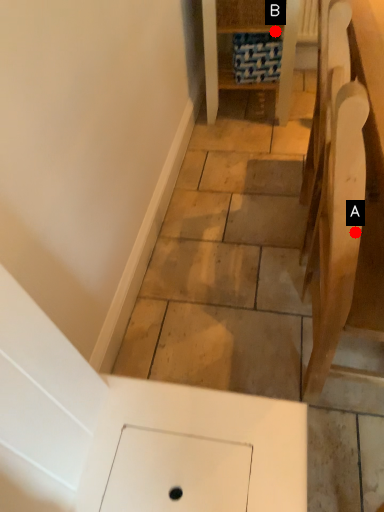
Question: Two points are circled on the image, labeled by A and B beside each circle. Among these points, which one is nearest to the camera?

Choices:
 (A) A is closer
 (B) B is closer

Answer: (A)